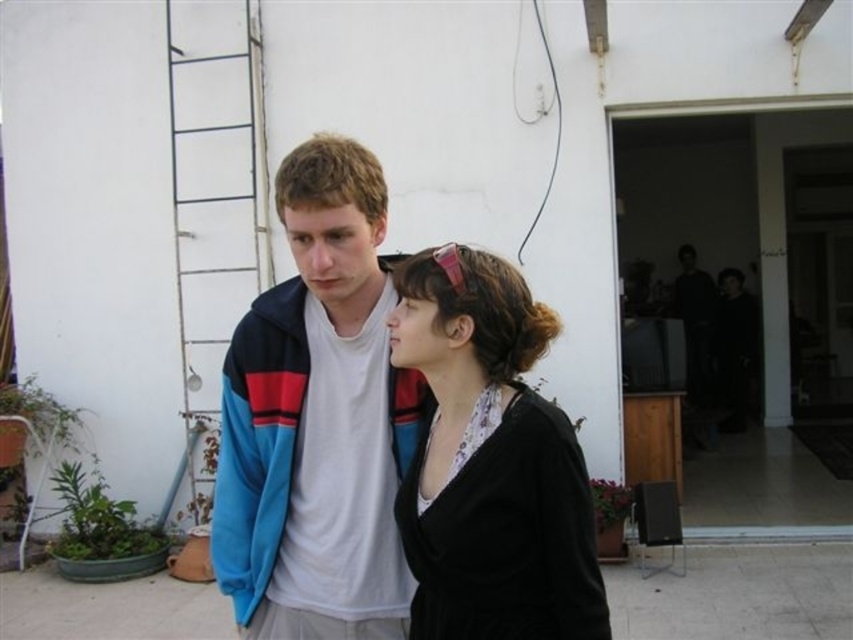
Question: In this image, where is blue fleece jacket at center located relative to black matte sweater at center?

Choices:
 (A) below
 (B) above

Answer: (B)

Question: Which point is closer to the camera taking this photo?

Choices:
 (A) (352, 300)
 (B) (447, 465)

Answer: (B)

Question: Does blue fleece jacket at center have a larger size compared to black matte sweater at center?

Choices:
 (A) yes
 (B) no

Answer: (A)

Question: Which object appears farthest from the camera in this image?

Choices:
 (A) black matte sweater at center
 (B) blue fleece jacket at center

Answer: (B)

Question: Which object appears closest to the camera in this image?

Choices:
 (A) black matte sweater at center
 (B) blue fleece jacket at center

Answer: (A)

Question: Considering the relative positions of blue fleece jacket at center and black matte sweater at center in the image provided, where is blue fleece jacket at center located with respect to black matte sweater at center?

Choices:
 (A) below
 (B) above

Answer: (B)